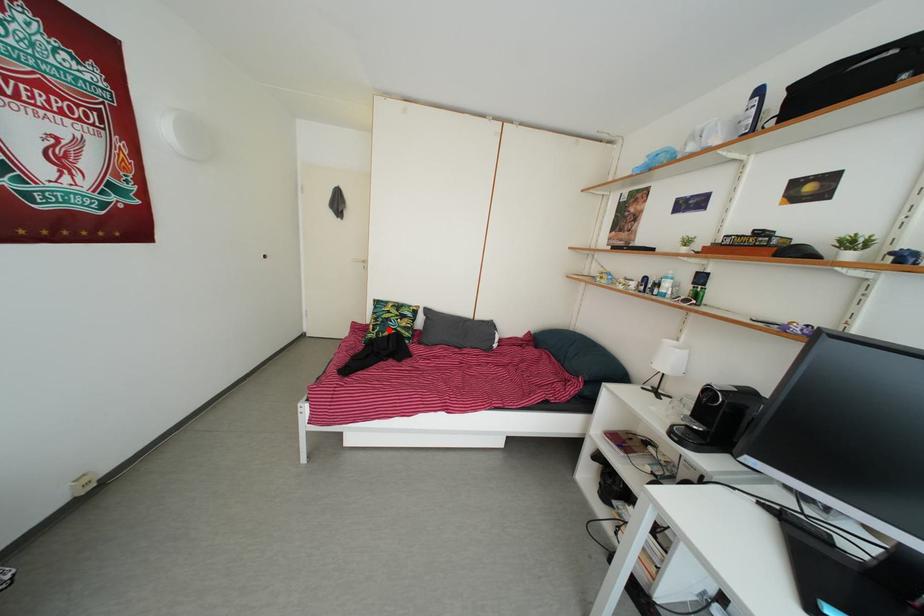
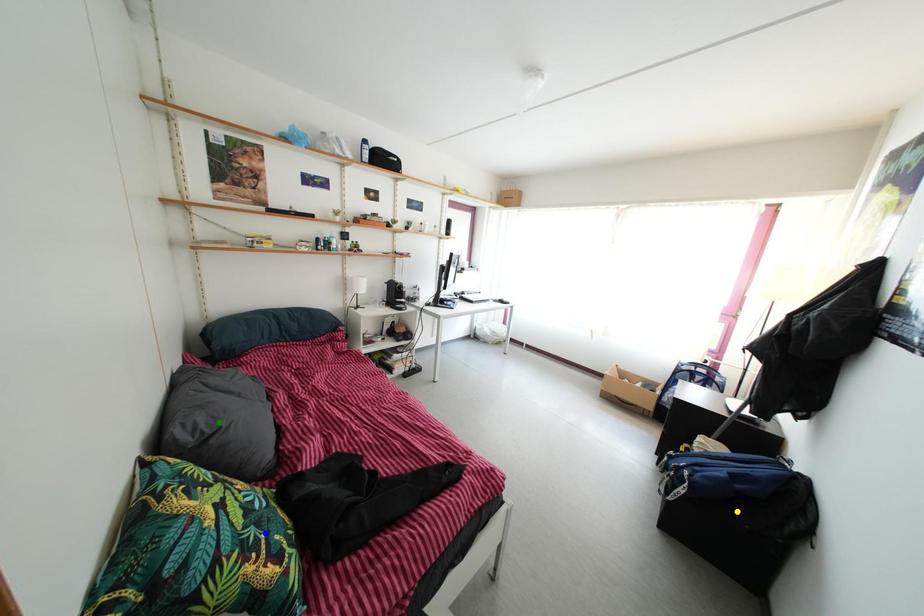
Question: I am providing you with two images of the same scene from different viewpoints. A red point is marked on the first image. You are given multiple points on the second image. Which mark in image 2 goes with the point in image 1?

Choices:
 (A) green point
 (B) blue point
 (C) yellow point

Answer: (B)